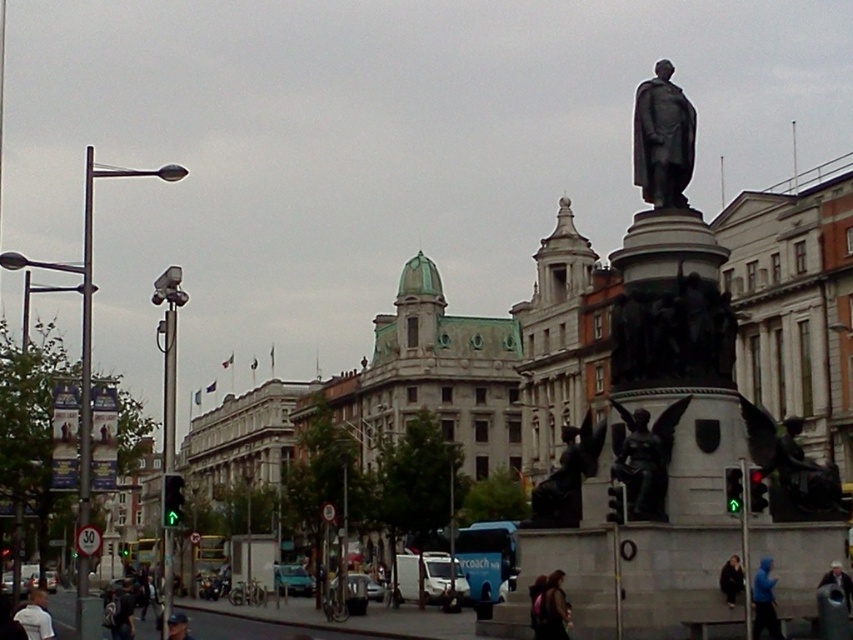
You are an urban planner assessing the space around the statue. You need to place a new bench that must be narrower than the polished bronze angel at center. Can the bench fit next to the blue hooded jacket at lower right without exceeding its width?

The polished bronze angel at center is wider than the blue hooded jacket at lower right. Since the bench must be narrower than the polished bronze angel at center, it can fit next to the blue hooded jacket at lower right as long as it doesn not exceed the jacket s width.

You are a photographer standing in the urban scene and want to capture both the blue hooded jacket at lower right and the dark blue jacket at lower right in the same frame. Which jacket should you focus on first to ensure both are visible?

You should focus on the dark blue jacket at lower right first because the blue hooded jacket at lower right is positioned under it, so adjusting the camera angle to include the lower jacket will naturally include the upper one as well.